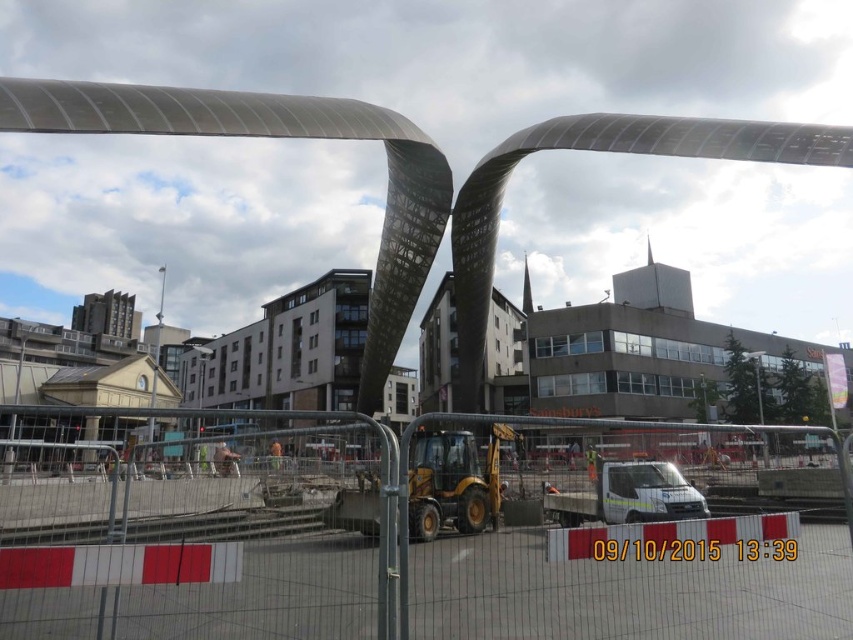
Is white plastic fencing at lower center thinner than yellow rubber excavator at center?

No.

Does white plastic fencing at lower center appear over yellow rubber excavator at center?

Actually, white plastic fencing at lower center is below yellow rubber excavator at center.

The height and width of the screenshot is (640, 853). Describe the element at coordinates (421, 531) in the screenshot. I see `white plastic fencing at lower center` at that location.

Locate an element on the screen. Image resolution: width=853 pixels, height=640 pixels. white plastic fencing at lower center is located at coordinates (421, 531).